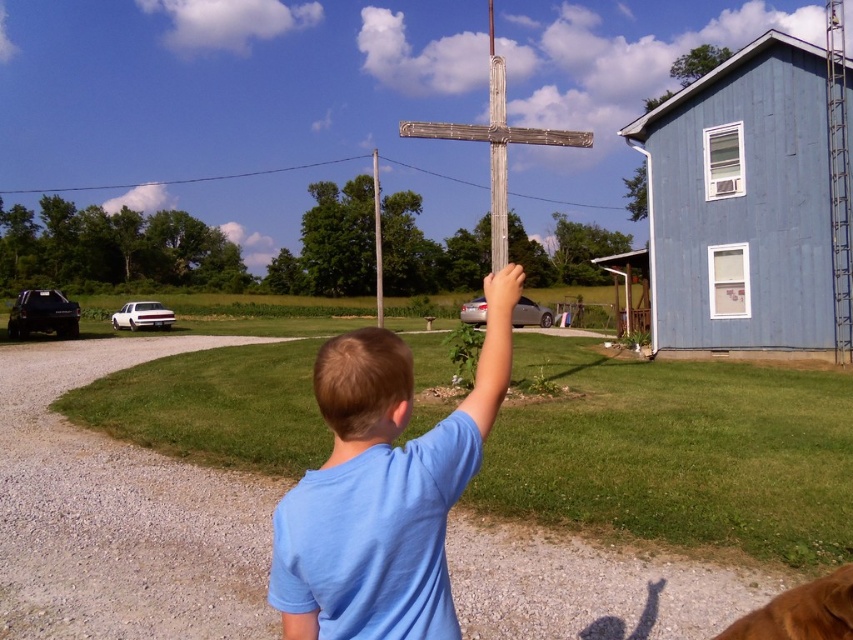
You are a photographer standing in front of the blue cotton shirt at center. You want to take a clear photo of it without any blur. The camera you are using has a minimum focusing distance of 1.5 meters. Can you take the photo clearly?

The blue cotton shirt at center is 1.59 meters away from camera. Since the minimum focusing distance is 1.5 meters, the camera can focus clearly at 1.59 meters. Therefore, you can take a clear photo of the blue cotton shirt at center without blur.

You are standing at the position of the young boy on the gravel driveway. You see two points in the scene, one at point [450,477] and another at point [729,627]. Which point is closer to you?

Point [450,477] is closer to you than point [729,627].